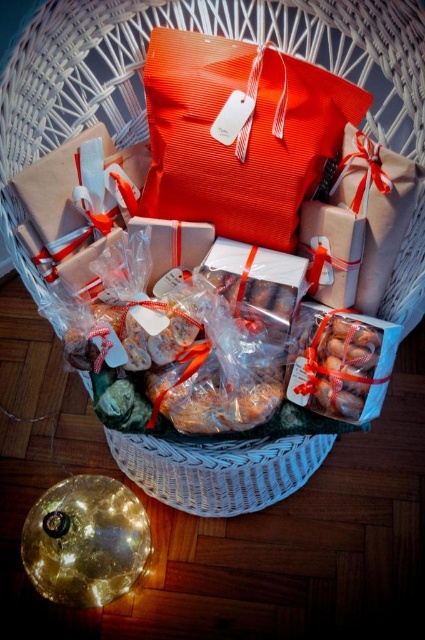
You are trying to determine which item is taller between the matte orange fabric gift bag at center and the translucent plastic bag of cookies at center in the gift basket. Based on the scene, which one is taller?

The matte orange fabric gift bag at center is taller than the translucent plastic bag of cookies at center.

You are organizing a gift basket and need to place a matte orange fabric gift bag at center and a translucent plastic bag of cookies at center. Given their sizes, which item should you place first to ensure proper arrangement?

The matte orange fabric gift bag at center is wider than the translucent plastic bag of cookies at center, so you should place the matte orange fabric gift bag at center first to accommodate its larger size before arranging the smaller cookie bag.